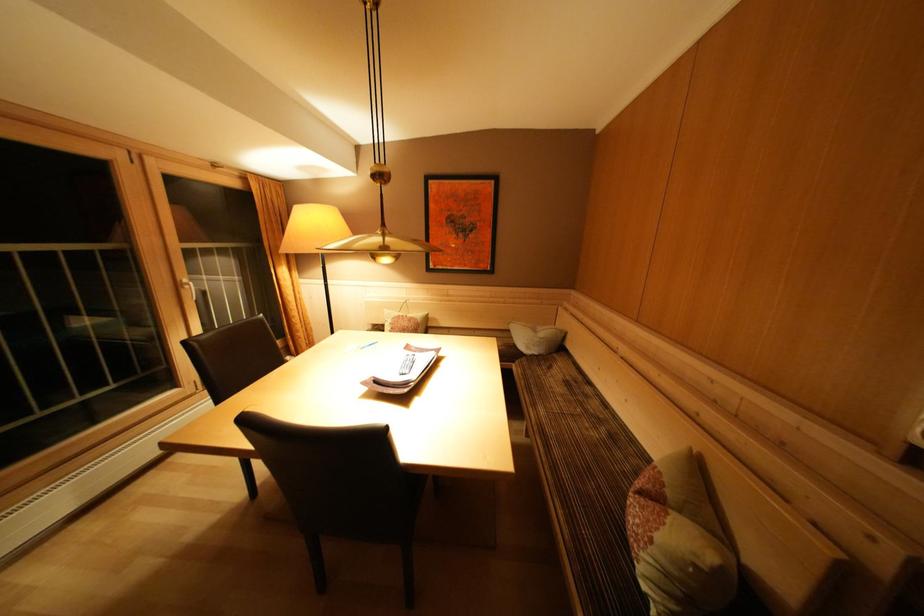
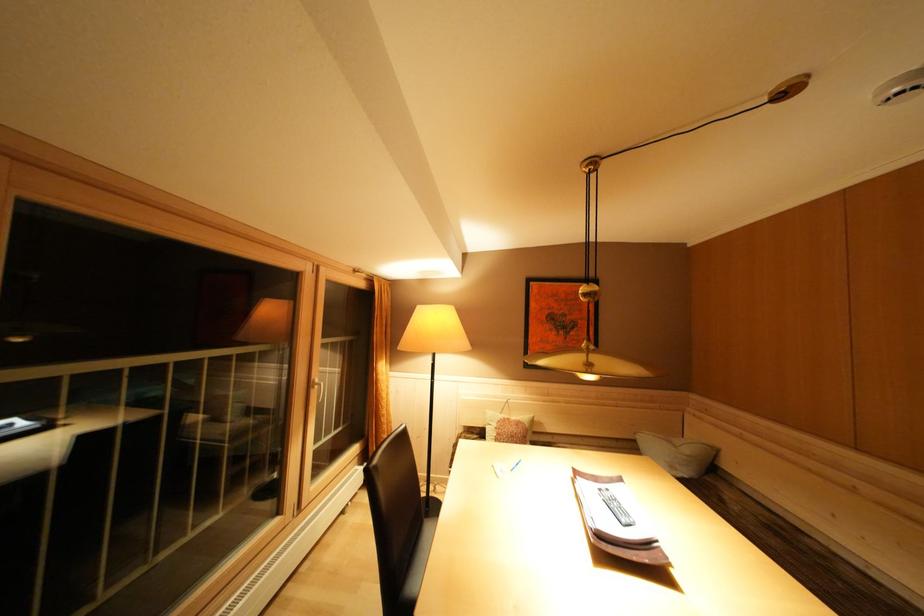
The point at (192,286) is marked in the first image. Where is the corresponding point in the second image?

(323, 386)